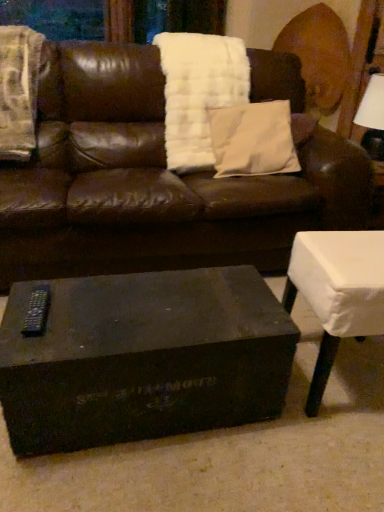
Locate an element on the screen. The image size is (384, 512). white cloth-covered table at lower right is located at coordinates (337, 292).

Locate an element on the screen. white soft pillow at center is located at coordinates (253, 140).

What is the approximate height of white fuzzy blanket at left, the 2th blanket positioned from the right?

21.94 inches.

Measure the distance between white fuzzy blanket at left, marked as the 1th blanket in a left-to-right arrangement, and camera.

white fuzzy blanket at left, marked as the 1th blanket in a left-to-right arrangement, is 6.12 feet away from camera.

What do you see at coordinates (37, 311) in the screenshot? I see `black plastic remote at lower left` at bounding box center [37, 311].

Where is `black plastic remote at lower left`? black plastic remote at lower left is located at coordinates (37, 311).

What do you see at coordinates (152, 182) in the screenshot? I see `brown leather couch at center` at bounding box center [152, 182].

Describe the element at coordinates (372, 117) in the screenshot. I see `white fabric lampshade at upper right` at that location.

The width and height of the screenshot is (384, 512). Describe the element at coordinates (143, 358) in the screenshot. I see `matte black coffee table at center` at that location.

Identify the location of matte black coffee table at center. (143, 358).

The width and height of the screenshot is (384, 512). What are the coordinates of `white cloth-covered table at lower right` in the screenshot? It's located at (337, 292).

Does point (34, 122) lie behind point (316, 308)?

Yes, point (34, 122) is farther from viewer.

Considering the relative positions of white fuzzy blanket at left, marked as the 1th blanket in a left-to-right arrangement, and white cloth-covered table at lower right in the image provided, is white fuzzy blanket at left, marked as the 1th blanket in a left-to-right arrangement, in front of white cloth-covered table at lower right?

No, white fuzzy blanket at left, marked as the 1th blanket in a left-to-right arrangement, is further to the viewer.

Are white fuzzy blanket at left, the 2th blanket positioned from the right, and white cloth-covered table at lower right located far from each other?

Yes.

Can you confirm if white fuzzy blanket at left, marked as the 1th blanket in a left-to-right arrangement, is positioned to the right of white cloth-covered table at lower right?

In fact, white fuzzy blanket at left, marked as the 1th blanket in a left-to-right arrangement, is to the left of white cloth-covered table at lower right.

How much distance is there between brown leather couch at center and white cloth-covered table at lower right?

A distance of 71.95 centimeters exists between brown leather couch at center and white cloth-covered table at lower right.

Can we say brown leather couch at center lies outside white cloth-covered table at lower right?

Yes, brown leather couch at center is not within white cloth-covered table at lower right.

Between brown leather couch at center and white cloth-covered table at lower right, which one has more height?

With more height is brown leather couch at center.

Consider the image. Does brown leather couch at center turn towards white cloth-covered table at lower right?

Yes.

Would you say matte black coffee table at center is inside or outside black plastic remote at lower left?

matte black coffee table at center is outside black plastic remote at lower left.

Is there a large distance between matte black coffee table at center and black plastic remote at lower left?

That's not correct — matte black coffee table at center is a little close to black plastic remote at lower left.

Which point is more forward, (11,424) or (43,328)?

The point (11,424) is in front.

Which object is thinner, white cloth-covered table at lower right or white soft pillow at center?

white soft pillow at center is thinner.

Is the depth of white cloth-covered table at lower right greater than that of white soft pillow at center?

No, white cloth-covered table at lower right is closer to the viewer.

Considering the relative positions of white cloth-covered table at lower right and white soft pillow at center in the image provided, is white cloth-covered table at lower right to the left or to the right of white soft pillow at center?

white cloth-covered table at lower right is positioned on white soft pillow at center's right side.

Is white cloth-covered table at lower right not inside white soft pillow at center?

Absolutely, white cloth-covered table at lower right is external to white soft pillow at center.

Can you confirm if white soft pillow at center is thinner than black plastic remote at lower left?

Incorrect, the width of white soft pillow at center is not less than that of black plastic remote at lower left.

Is black plastic remote at lower left surrounded by white soft pillow at center?

Definitely not — black plastic remote at lower left is not inside white soft pillow at center.

Is white soft pillow at center to the left or to the right of black plastic remote at lower left in the image?

Clearly, white soft pillow at center is on the right of black plastic remote at lower left in the image.

From a real-world perspective, is white soft pillow at center positioned over black plastic remote at lower left based on gravity?

Correct, in the physical world, white soft pillow at center is higher than black plastic remote at lower left.

Does point (196, 399) appear closer or farther from the camera than point (12, 84)?

Point (196, 399).

The image size is (384, 512). I want to click on the 2nd blanket located above the matte black coffee table at center (from a real-world perspective), so click(x=18, y=91).

What's the angular difference between matte black coffee table at center and white fuzzy blanket at left, marked as the 1th blanket in a left-to-right arrangement,'s facing directions?

The angle between the facing direction of matte black coffee table at center and the facing direction of white fuzzy blanket at left, marked as the 1th blanket in a left-to-right arrangement, is 4.5 degrees.

Can white fuzzy blanket at left, the 2th blanket positioned from the right, be found inside matte black coffee table at center?

Definitely not — white fuzzy blanket at left, the 2th blanket positioned from the right, is not inside matte black coffee table at center.

What are the coordinates of `blanket that is the 1st object located above the black plastic remote at lower left (from the image's perspective)` in the screenshot? It's located at (18, 91).

Is white fuzzy blanket at left, the 2th blanket positioned from the right, at the back of black plastic remote at lower left?

No, black plastic remote at lower left's orientation is not away from white fuzzy blanket at left, the 2th blanket positioned from the right.

From the picture: Measure the distance from black plastic remote at lower left to white fuzzy blanket at left, the 2th blanket positioned from the right.

black plastic remote at lower left and white fuzzy blanket at left, the 2th blanket positioned from the right, are 1.12 meters apart.

From the image's perspective, which one is positioned higher, black plastic remote at lower left or white fuzzy blanket at left, marked as the 1th blanket in a left-to-right arrangement?

white fuzzy blanket at left, marked as the 1th blanket in a left-to-right arrangement, appears higher in the image.

You are a GUI agent. You are given a task and a screenshot of the screen. Output one action in this format:
    pyautogui.click(x=<x>, y=<y>)
    Task: Click on the 1st blanket behind when counting from the white cloth-covered table at lower right
    This screenshot has height=512, width=384.
    Given the screenshot: What is the action you would take?
    pyautogui.click(x=18, y=91)

Identify the location of table on the right of brown leather couch at center. (337, 292).

In the scene shown: Based on their spatial positions, is brown leather couch at center or white cloth-covered table at lower right closer to matte black coffee table at center?

Based on the image, white cloth-covered table at lower right appears to be nearer to matte black coffee table at center.

Which object lies further to the anchor point matte black coffee table at center, white cloth-covered table at lower right or white fluffy blanket at upper center, the 2th blanket positioned from the left?

Among the two, white fluffy blanket at upper center, the 2th blanket positioned from the left, is located further to matte black coffee table at center.

From the image, which object appears to be farther from white cloth-covered table at lower right, matte black coffee table at center or brown leather couch at center?

brown leather couch at center.

When comparing their distances from white soft pillow at center, does white fabric lampshade at upper right or black plastic remote at lower left seem further?

black plastic remote at lower left is positioned further to the anchor white soft pillow at center.

Estimate the real-world distances between objects in this image. Which object is further from white fluffy blanket at upper center, the first blanket in the right-to-left sequence, matte black coffee table at center or brown leather couch at center?

Among the two, matte black coffee table at center is located further to white fluffy blanket at upper center, the first blanket in the right-to-left sequence.

Based on their spatial positions, is white fuzzy blanket at left, marked as the 1th blanket in a left-to-right arrangement, or white fabric lampshade at upper right closer to white soft pillow at center?

Based on the image, white fabric lampshade at upper right appears to be nearer to white soft pillow at center.

Looking at the image, which one is located closer to black plastic remote at lower left, brown leather couch at center or matte black coffee table at center?

matte black coffee table at center is closer to black plastic remote at lower left.

Looking at the image, which one is located closer to black plastic remote at lower left, brown leather couch at center or white soft pillow at center?

brown leather couch at center is closer to black plastic remote at lower left.

The image size is (384, 512). Identify the location of studio couch between white fuzzy blanket at left, marked as the 1th blanket in a left-to-right arrangement, and white fluffy blanket at upper center, the 2th blanket positioned from the left, from left to right. (152, 182).

Locate an element on the screen. studio couch that lies between white fuzzy blanket at left, the 2th blanket positioned from the right, and matte black coffee table at center from top to bottom is located at coordinates (152, 182).

Find the location of a particular element. The image size is (384, 512). studio couch between white fuzzy blanket at left, marked as the 1th blanket in a left-to-right arrangement, and white cloth-covered table at lower right from left to right is located at coordinates (152, 182).

You are a GUI agent. You are given a task and a screenshot of the screen. Output one action in this format:
    pyautogui.click(x=<x>, y=<y>)
    Task: Click on the remote located between white fuzzy blanket at left, the 2th blanket positioned from the right, and white cloth-covered table at lower right in the left-right direction
    This screenshot has height=512, width=384.
    Given the screenshot: What is the action you would take?
    pyautogui.click(x=37, y=311)